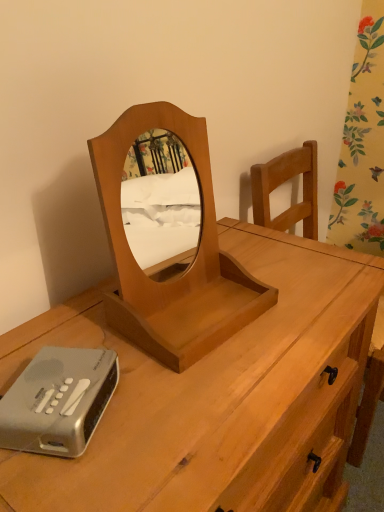
This screenshot has width=384, height=512. I want to click on free space in front of light brown wood mirror at center, so click(x=198, y=400).